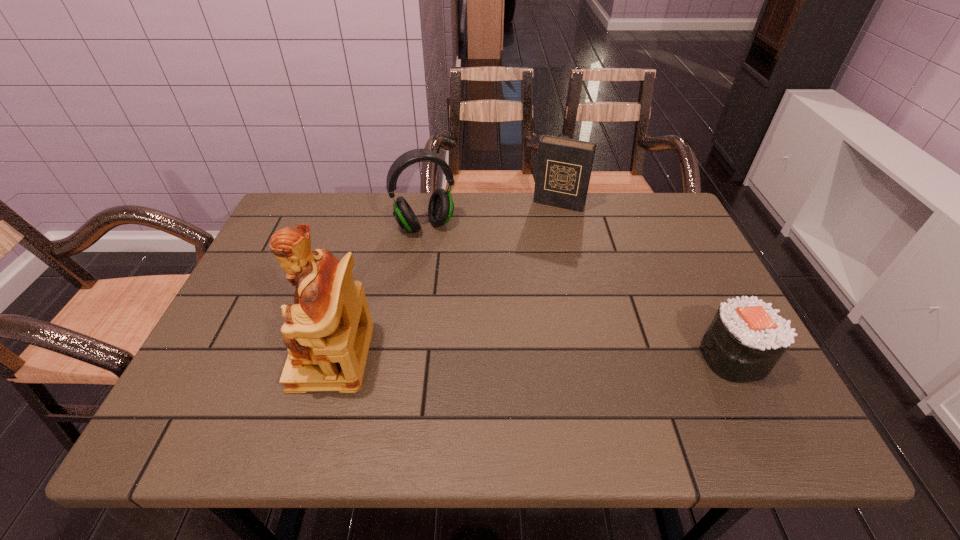
This screenshot has height=540, width=960. Find the location of `free space that is in between the diary and the headset`. free space that is in between the diary and the headset is located at coordinates (492, 214).

The image size is (960, 540). Find the location of `blank region between the second object from right to left and the rightmost object`. blank region between the second object from right to left and the rightmost object is located at coordinates (646, 280).

I want to click on vacant area that lies between the headset and the second object from right to left, so click(x=492, y=214).

Where is `free space between the diary and the tallest object`? The image size is (960, 540). free space between the diary and the tallest object is located at coordinates (445, 280).

Locate an element on the screen. The image size is (960, 540). free space between the tallest object and the second object from right to left is located at coordinates (445, 280).

You are a GUI agent. You are given a task and a screenshot of the screen. Output one action in this format:
    pyautogui.click(x=<x>, y=<y>)
    Task: Click on the vacant area that lies between the diary and the rightmost object
    The image size is (960, 540).
    Given the screenshot: What is the action you would take?
    pyautogui.click(x=646, y=280)

This screenshot has width=960, height=540. I want to click on free space that is in between the shortest object and the headset, so click(579, 291).

Find the location of a particular element. the third closest object to the diary is located at coordinates (328, 329).

At what (x,y) coordinates should I click in order to perform the action: click on object that is the third nearest to the rightmost object. Please return your answer as a coordinate pair (x, y). The width and height of the screenshot is (960, 540). Looking at the image, I should click on (328, 329).